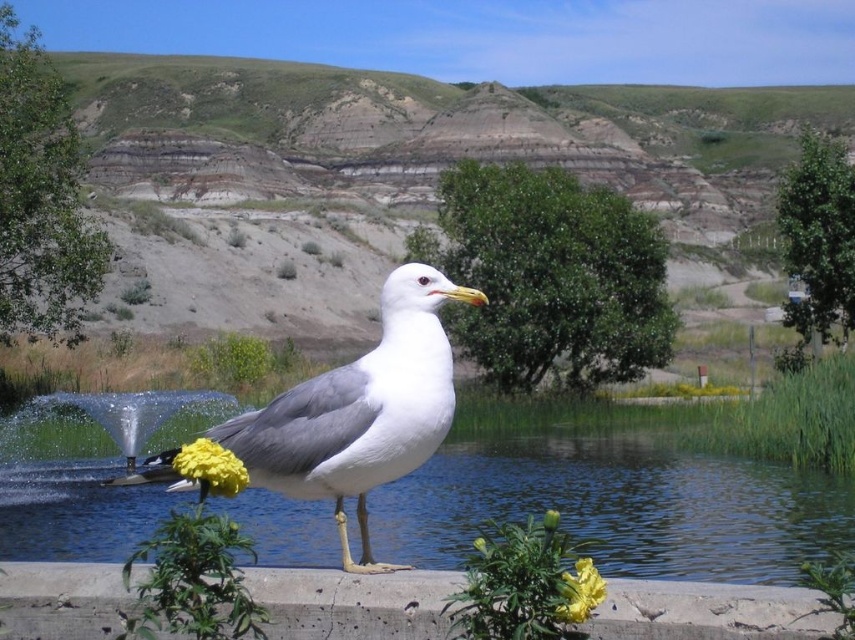
Does white matte seagull at center appear on the right side of yellow matte flower at lower center?

In fact, white matte seagull at center is to the left of yellow matte flower at lower center.

Is white matte seagull at center taller than yellow matte flower at lower center?

Yes, white matte seagull at center is taller than yellow matte flower at lower center.

Who is more forward, (399, 428) or (570, 595)?

Point (570, 595)

Where is `white matte seagull at center`? white matte seagull at center is located at coordinates tap(360, 412).

Based on the photo, which of these two, clear blue water at center or yellow matte flower at lower center, stands shorter?

With less height is yellow matte flower at lower center.

Is clear blue water at center further to camera compared to yellow matte flower at lower center?

Yes, clear blue water at center is behind yellow matte flower at lower center.

The image size is (855, 640). In order to click on clear blue water at center in this screenshot , I will do `click(612, 499)`.

Identify the location of clear blue water at center. [x=612, y=499].

Which is more to the right, yellow matte flower at center or yellow matte flower at lower center?

yellow matte flower at lower center is more to the right.

The height and width of the screenshot is (640, 855). What do you see at coordinates (210, 468) in the screenshot? I see `yellow matte flower at center` at bounding box center [210, 468].

You are a GUI agent. You are given a task and a screenshot of the screen. Output one action in this format:
    pyautogui.click(x=<x>, y=<y>)
    Task: Click on the yellow matte flower at center
    
    Given the screenshot: What is the action you would take?
    pyautogui.click(x=210, y=468)